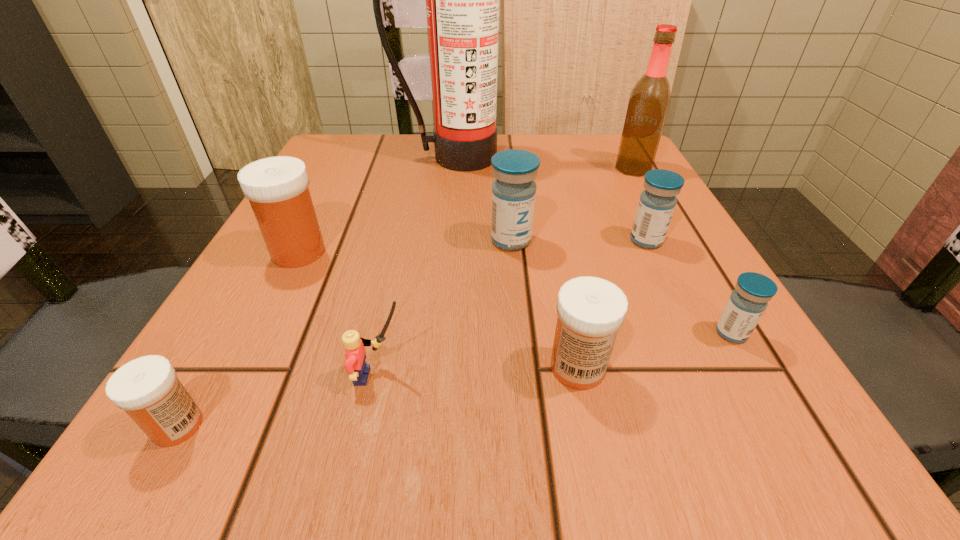
Locate an element on the screen. This screenshot has height=540, width=960. free space between the second farthest white medicine and the farthest white medicine is located at coordinates pos(438,309).

Where is `vacant space that is in between the Lego and the red fire extinguisher`? vacant space that is in between the Lego and the red fire extinguisher is located at coordinates (416, 267).

Image resolution: width=960 pixels, height=540 pixels. I want to click on free space between the fire extinguisher and the nearest blue medicine, so click(592, 245).

Locate an element on the screen. free point between the smallest white medicine and the yellow Lego is located at coordinates [278, 401].

The width and height of the screenshot is (960, 540). In order to click on empty space that is in between the beer bottle and the biggest blue medicine in this screenshot , I will do `click(572, 204)`.

The height and width of the screenshot is (540, 960). I want to click on object that stands as the sixth closest to the rightmost white medicine, so click(x=147, y=388).

Find the location of a particular element. The height and width of the screenshot is (540, 960). object that can be found as the fourth closest to the nearest blue medicine is located at coordinates (650, 98).

Locate which medicine ranks second in proximity to the second medicine from right to left. Please provide its 2D coordinates. Your answer should be formatted as a tuple, i.e. [(x, y)], where the tuple contains the x and y coordinates of a point satisfying the conditions above.

[(514, 190)]

Identify which medicine is the second closest to the second blue medicine from right to left. Please provide its 2D coordinates. Your answer should be formatted as a tuple, i.e. [(x, y)], where the tuple contains the x and y coordinates of a point satisfying the conditions above.

[(514, 190)]

Find the location of a particular element. This screenshot has height=540, width=960. the second closest blue medicine to the eighth shortest object is located at coordinates (514, 190).